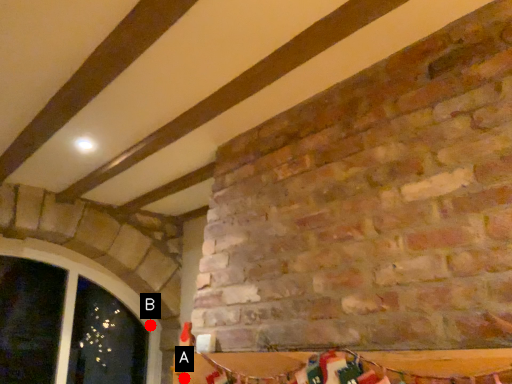
Question: Two points are circled on the image, labeled by A and B beside each circle. Which point appears closest to the camera in this image?

Choices:
 (A) A is closer
 (B) B is closer

Answer: (A)